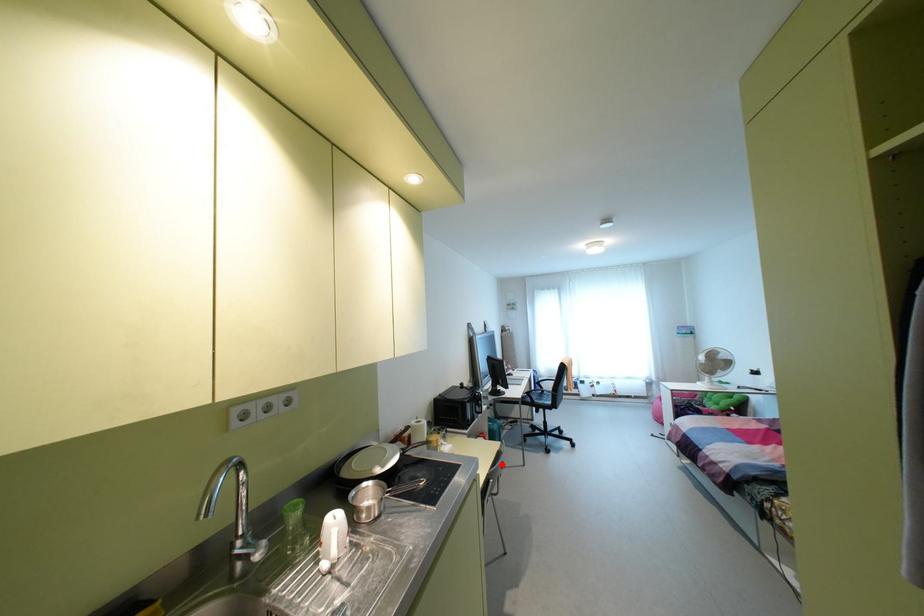
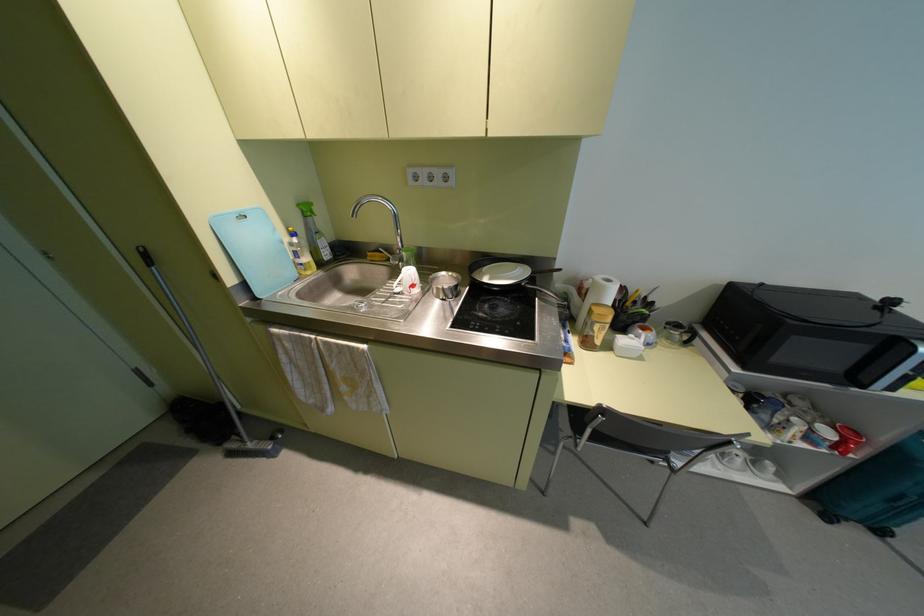
Question: I am providing you with two images of the same scene from different viewpoints. In image1, a red point is highlighted. Considering the same 3D point in image2, which of the following is correct?

Choices:
 (A) It is closer
 (B) It is farther

Answer: (A)